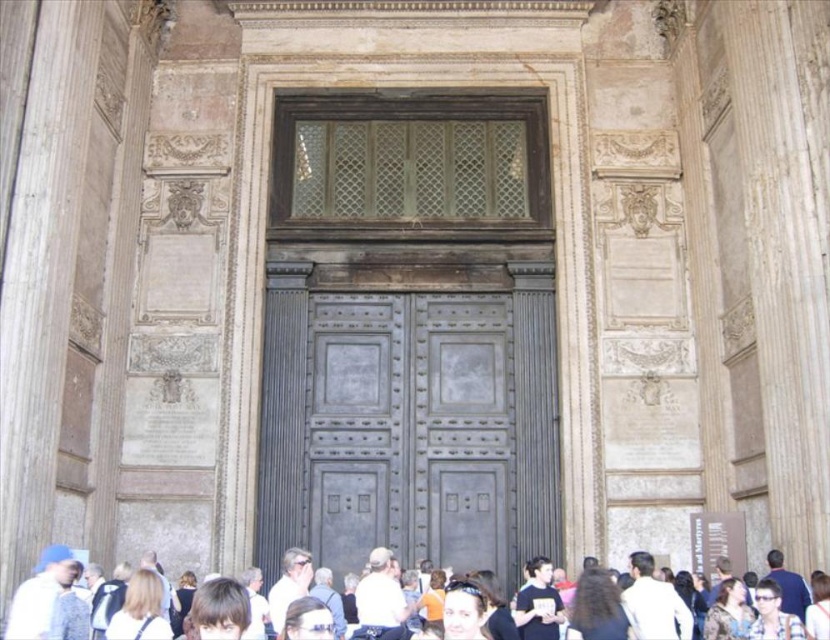
Is the position of white casual clothing at lower center more distant than that of matte black sunglasses at center?

No, white casual clothing at lower center is in front of matte black sunglasses at center.

Who is higher up, white casual clothing at lower center or matte black sunglasses at center?

matte black sunglasses at center

Which is behind, point (360, 586) or point (763, 614)?

Positioned behind is point (360, 586).

Identify the location of white casual clothing at lower center. (601, 609).

Between camouflage-patterned jacket at lower right and matte black sunglasses at center, which one is positioned higher?

matte black sunglasses at center is higher up.

Who is positioned more to the right, camouflage-patterned jacket at lower right or matte black sunglasses at center?

matte black sunglasses at center is more to the right.

What do you see at coordinates (728, 612) in the screenshot? I see `camouflage-patterned jacket at lower right` at bounding box center [728, 612].

You are a GUI agent. You are given a task and a screenshot of the screen. Output one action in this format:
    pyautogui.click(x=<x>, y=<y>)
    Task: Click on the camouflage-patterned jacket at lower right
    The height and width of the screenshot is (640, 830).
    Given the screenshot: What is the action you would take?
    pyautogui.click(x=728, y=612)

Does smooth brown hair at center have a greater width compared to matte black sunglasses at center?

No, smooth brown hair at center is not wider than matte black sunglasses at center.

Can you confirm if smooth brown hair at center is bigger than matte black sunglasses at center?

Correct, smooth brown hair at center is larger in size than matte black sunglasses at center.

Image resolution: width=830 pixels, height=640 pixels. I want to click on smooth brown hair at center, so click(464, 611).